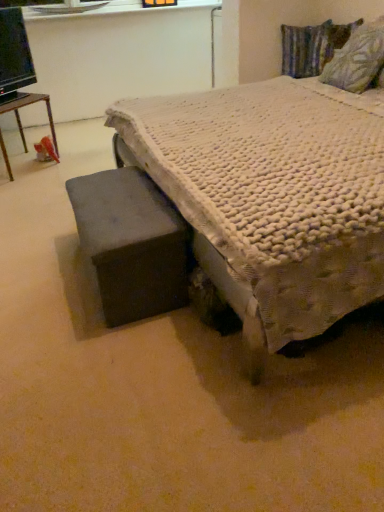
Question: From the image's perspective, does dark gray fabric ottoman at lower left appear lower than black glossy computer monitor at upper left?

Choices:
 (A) yes
 (B) no

Answer: (A)

Question: Is black glossy computer monitor at upper left surrounded by dark gray fabric ottoman at lower left?

Choices:
 (A) yes
 (B) no

Answer: (B)

Question: Is dark gray fabric ottoman at lower left shorter than black glossy computer monitor at upper left?

Choices:
 (A) yes
 (B) no

Answer: (A)

Question: Does dark gray fabric ottoman at lower left come in front of black glossy computer monitor at upper left?

Choices:
 (A) no
 (B) yes

Answer: (B)

Question: Is dark gray fabric ottoman at lower left positioned behind black glossy computer monitor at upper left?

Choices:
 (A) no
 (B) yes

Answer: (A)

Question: Is dark gray fabric ottoman at lower left directly adjacent to black glossy computer monitor at upper left?

Choices:
 (A) yes
 (B) no

Answer: (B)

Question: Is dark gray fabric ottoman at lower left further to the viewer compared to white textured bed at center?

Choices:
 (A) yes
 (B) no

Answer: (A)

Question: Is white textured bed at center at the back of dark gray fabric ottoman at lower left?

Choices:
 (A) yes
 (B) no

Answer: (A)

Question: From a real-world perspective, is dark gray fabric ottoman at lower left physically above white textured bed at center?

Choices:
 (A) no
 (B) yes

Answer: (A)

Question: From the image's perspective, is dark gray fabric ottoman at lower left above white textured bed at center?

Choices:
 (A) yes
 (B) no

Answer: (B)

Question: From the image's perspective, is dark gray fabric ottoman at lower left under white textured bed at center?

Choices:
 (A) yes
 (B) no

Answer: (A)

Question: Does dark gray fabric ottoman at lower left appear on the right side of white textured bed at center?

Choices:
 (A) no
 (B) yes

Answer: (A)

Question: From a real-world perspective, is dark gray fabric ottoman at lower left physically below textured fabric pillow at upper right, the 1th pillow in the front-to-back sequence?

Choices:
 (A) no
 (B) yes

Answer: (B)